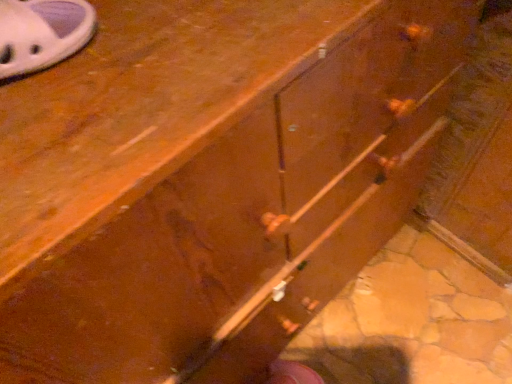
Question: Should I look upward or downward to see white fabric shoe at upper left?

Choices:
 (A) up
 (B) down

Answer: (A)